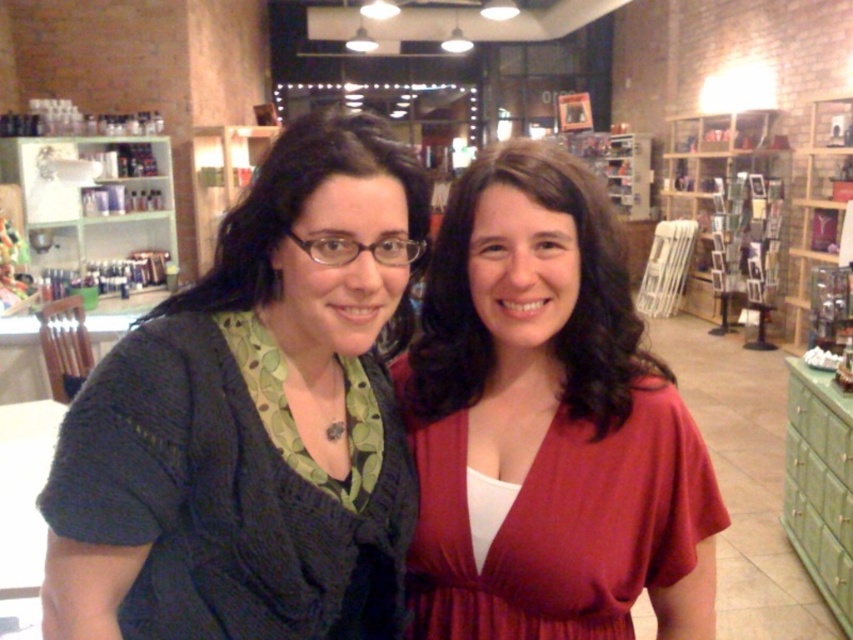
You are a customer in a store and want to choose between the knitted dark gray sweater at left and the matte red dress at center. Which item is narrower?

The knitted dark gray sweater at left is narrower than the matte red dress at center.

You are a customer in a store and want to pick up both the knitted dark gray sweater at left and the matte red dress at center. Which item should you reach for first to grab the one closer to you?

The knitted dark gray sweater at left is closer to the viewer than the matte red dress at center, so you should reach for the knitted dark gray sweater at left first.